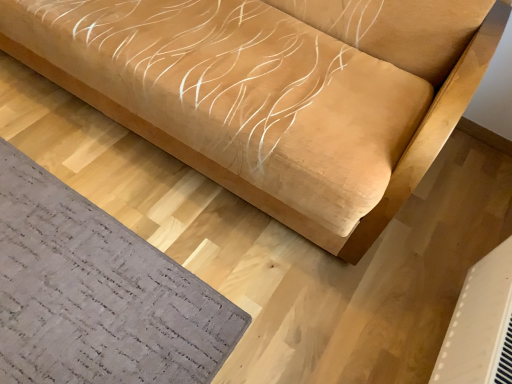
Image resolution: width=512 pixels, height=384 pixels. What are the coordinates of `vacant area situated below gray textured mat at lower left (from a real-world perspective)` in the screenshot? It's located at (83, 285).